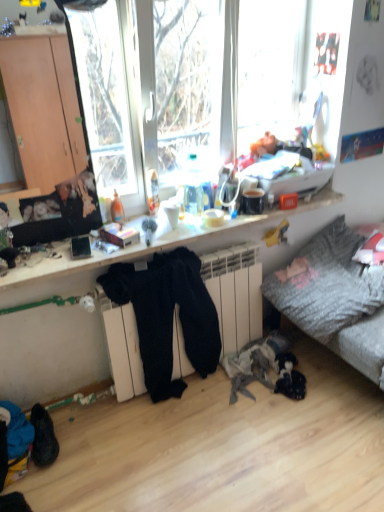
Identify the location of vacant area that is in front of black fuzzy pants at center. This screenshot has height=512, width=384. (168, 439).